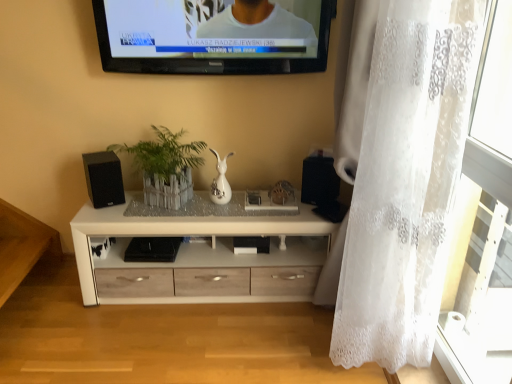
The height and width of the screenshot is (384, 512). In order to click on free spot above white wood chest of drawers at center (from a real-world perspective) in this screenshot , I will do `click(209, 205)`.